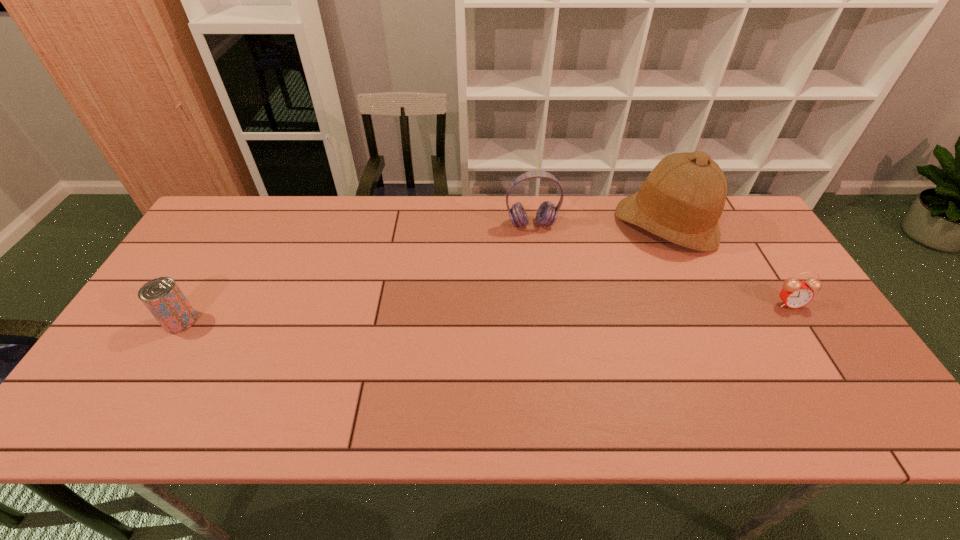
What are the coordinates of `blank area located 0.120m on the headband and ear cups of the headset` in the screenshot? It's located at (540, 259).

Locate an element on the screen. Image resolution: width=960 pixels, height=540 pixels. free space located 0.340m on the front-facing side of the third object from left to right is located at coordinates (572, 307).

At what (x,y) coordinates should I click in order to perform the action: click on vacant space positioned on the front-facing side of the third object from left to right. Please return your answer as a coordinate pair (x, y). Looking at the image, I should click on (615, 268).

The image size is (960, 540). I want to click on vacant region located on the front-facing side of the third object from left to right, so click(563, 316).

Where is `headset at the far edge`? This screenshot has width=960, height=540. headset at the far edge is located at coordinates (547, 213).

Where is `hat present at the far edge`? hat present at the far edge is located at coordinates (682, 199).

The height and width of the screenshot is (540, 960). What are the coordinates of `object located at the left edge` in the screenshot? It's located at (163, 298).

The height and width of the screenshot is (540, 960). In order to click on alarm clock located in the right edge section of the desktop in this screenshot , I will do `click(795, 294)`.

At what (x,y) coordinates should I click in order to perform the action: click on hat that is at the right edge. Please return your answer as a coordinate pair (x, y). The width and height of the screenshot is (960, 540). Looking at the image, I should click on [x=682, y=199].

You are a GUI agent. You are given a task and a screenshot of the screen. Output one action in this format:
    pyautogui.click(x=<x>, y=<y>)
    Task: Click on the object that is at the far right corner
    This screenshot has height=540, width=960.
    Given the screenshot: What is the action you would take?
    pyautogui.click(x=682, y=199)